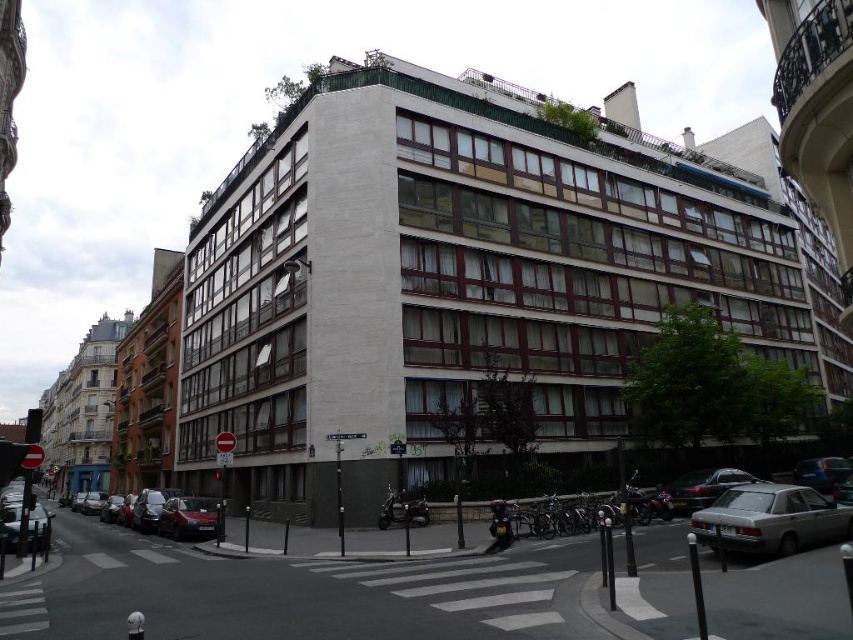
Is metallic silver car at center closer to the viewer compared to dark red matte car at lower left?

Yes, metallic silver car at center is closer to the viewer.

From the picture: Is metallic silver car at center thinner than dark red matte car at lower left?

A: In fact, metallic silver car at center might be wider than dark red matte car at lower left.

Who is more distant from viewer, (492, 582) or (183, 499)?

The point (183, 499) is more distant.

Where is `metallic silver car at center`? The width and height of the screenshot is (853, 640). metallic silver car at center is located at coordinates (297, 593).

Which of these two, dark red matte car at lower left or shiny red car at lower left, stands taller?

With more height is dark red matte car at lower left.

Who is positioned more to the right, dark red matte car at lower left or shiny red car at lower left?

Positioned to the right is shiny red car at lower left.

Does point (183, 536) lie in front of point (215, 524)?

No, (183, 536) is behind (215, 524).

The width and height of the screenshot is (853, 640). In order to click on dark red matte car at lower left in this screenshot , I will do `click(170, 515)`.

Does silver metallic sedan at lower right have a smaller size compared to shiny red car at lower left?

Yes.

Between point (805, 492) and point (206, 513), which one is positioned behind?

Point (206, 513)

You are a GUI agent. You are given a task and a screenshot of the screen. Output one action in this format:
    pyautogui.click(x=<x>, y=<y>)
    Task: Click on the silver metallic sedan at lower right
    The height and width of the screenshot is (640, 853).
    Given the screenshot: What is the action you would take?
    pyautogui.click(x=770, y=518)